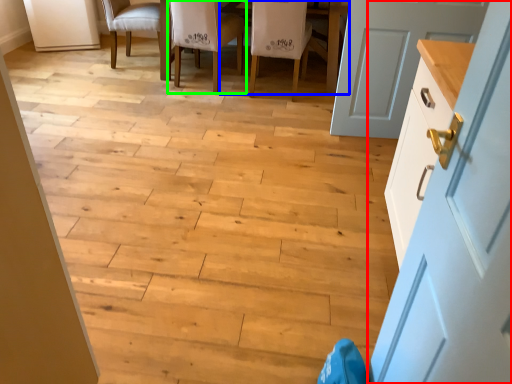
Question: Which is nearer to the door (highlighted by a red box)? table (highlighted by a blue box) or chair (highlighted by a green box).

Choices:
 (A) table
 (B) chair

Answer: (A)